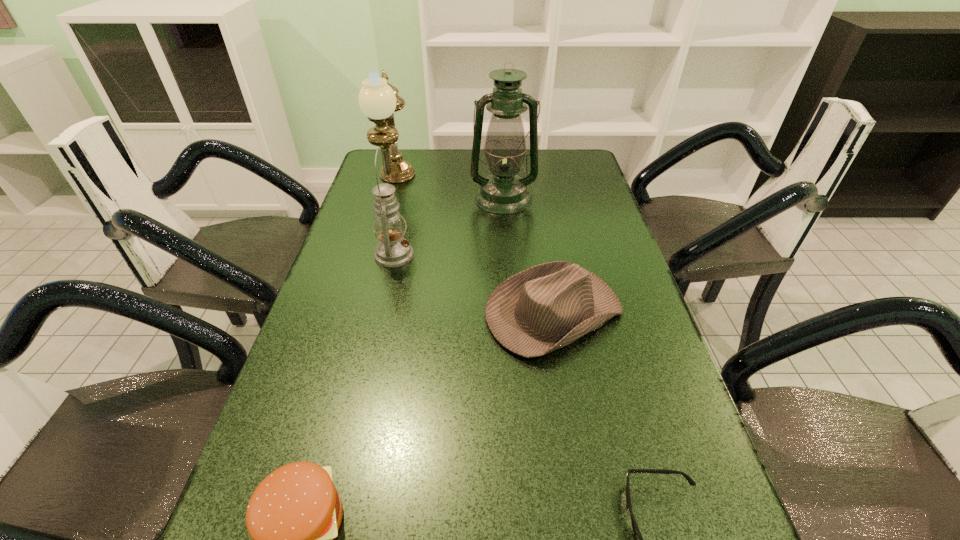
You are a GUI agent. You are given a task and a screenshot of the screen. Output one action in this format:
    pyautogui.click(x=<x>, y=<y>)
    Task: Click on the object at the far left corner
    Image resolution: width=960 pixels, height=540 pixels.
    Given the screenshot: What is the action you would take?
    pyautogui.click(x=378, y=99)

You are a GUI agent. You are given a task and a screenshot of the screen. Output one action in this format:
    pyautogui.click(x=<x>, y=<y>)
    Task: Click on the vacant space at the far edge of the desktop
    This screenshot has height=540, width=960.
    Given the screenshot: What is the action you would take?
    537,178

The height and width of the screenshot is (540, 960). In the image, there is a desktop. Find the location of `free space at the left edge`. free space at the left edge is located at coordinates (276, 437).

I want to click on free space at the right edge, so click(581, 187).

Identify the location of vacant space in between the fourth shortest object and the rightmost oil lamp. The height and width of the screenshot is (540, 960). (448, 227).

The width and height of the screenshot is (960, 540). In order to click on free spot between the rightmost oil lamp and the third tallest object in this screenshot , I will do `click(448, 227)`.

This screenshot has width=960, height=540. What are the coordinates of `object that ranks as the fourth closest to the third nearest object` in the screenshot? It's located at (294, 514).

At what (x,y) coordinates should I click in order to perform the action: click on object identified as the second closest to the nearest oil lamp. Please return your answer as a coordinate pair (x, y). Looking at the image, I should click on (546, 307).

Locate which oil lamp is the closest to the shortest object. Please provide its 2D coordinates. Your answer should be formatted as a tuple, i.e. [(x, y)], where the tuple contains the x and y coordinates of a point satisfying the conditions above.

[(393, 250)]

Locate which oil lamp is the closest to the hamburger. Please provide its 2D coordinates. Your answer should be formatted as a tuple, i.e. [(x, y)], where the tuple contains the x and y coordinates of a point satisfying the conditions above.

[(393, 250)]